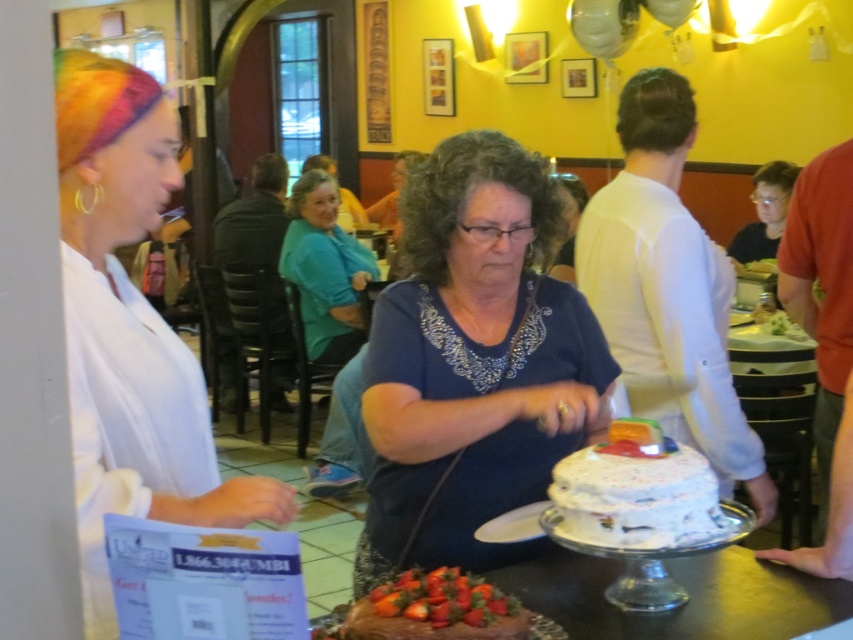
You are a photographer taking a photo of the teal fabric shirt at center and the smooth chocolate cake at center. Which object should you focus on first if you want to ensure both are in frame but prioritize the taller one?

The teal fabric shirt at center is taller than the smooth chocolate cake at center, so you should focus on the teal fabric shirt at center first to ensure it is properly framed.

You are a photographer at the event and need to capture a photo of both the teal fabric shirt at center and the smooth chocolate cake at center. Which object should you focus on first if you want to ensure both are in frame without moving the camera?

The teal fabric shirt at center is positioned on the left side of the smooth chocolate cake at center. Since the shirt is to the left of the cake, you should focus on the teal fabric shirt at center first to ensure both are within the camera frame without needing to adjust the camera position.

You are a customer in this restaurant and you want to place your phone on the nearest available surface. You see the white matte paper at left and the teal fabric shirt at center. Which surface can you use without worrying about it being too low?

The white matte paper at left has a lesser height compared to the teal fabric shirt at center, so you should place your phone on the teal fabric shirt at center since it is taller and provides a more stable surface.